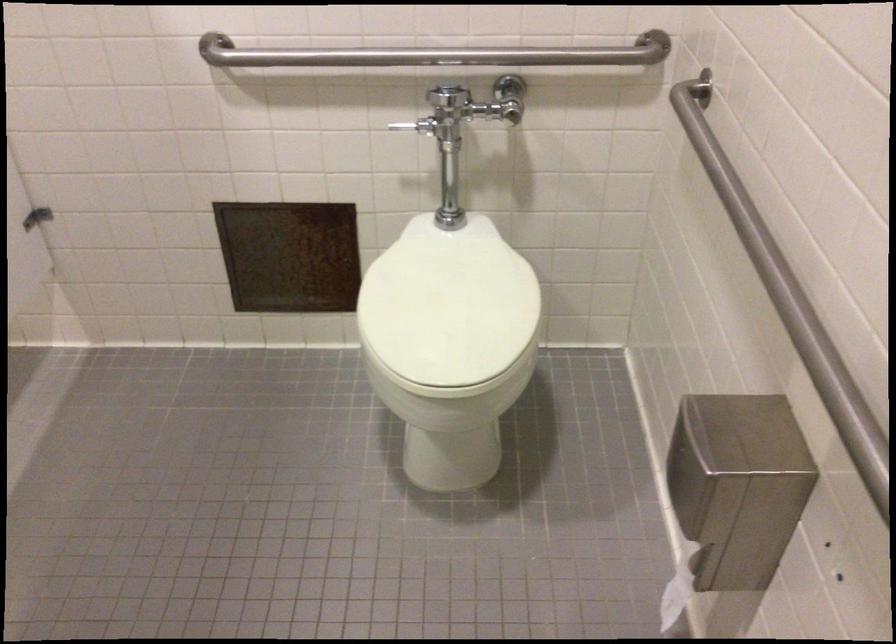
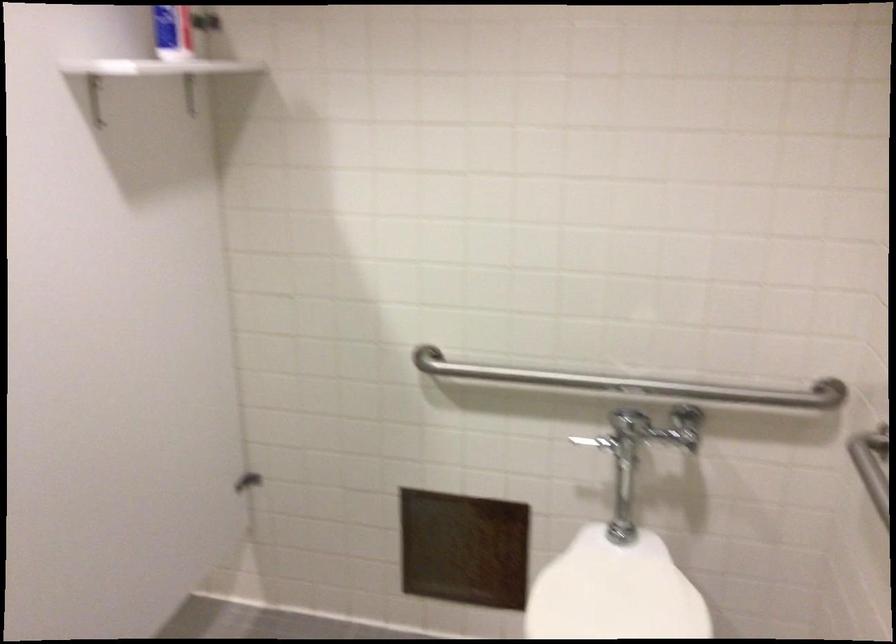
Question: The images are taken continuously from a first-person perspective. In which direction is your viewpoint rotating?

Choices:
 (A) Left
 (B) Right
 (C) Up
 (D) Down

Answer: (C)